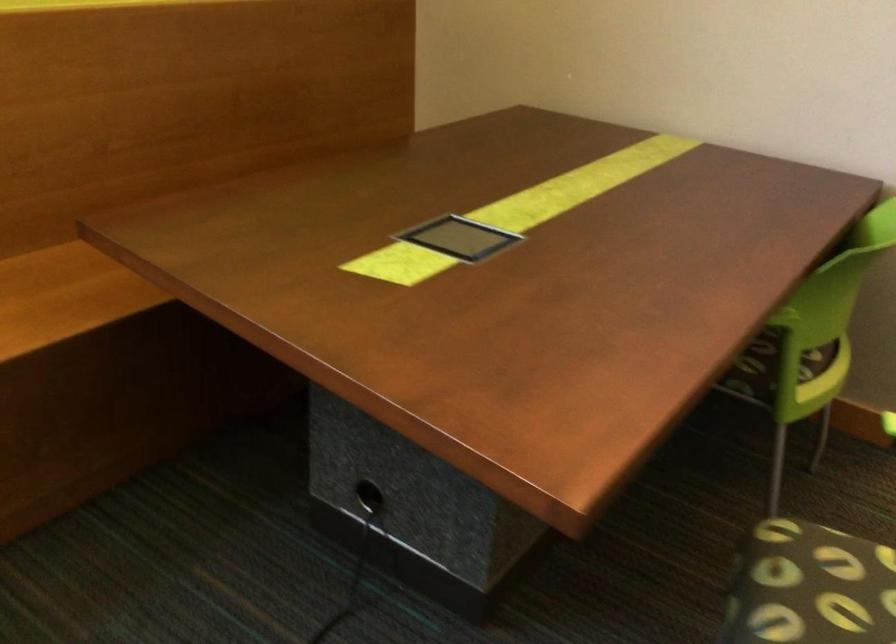
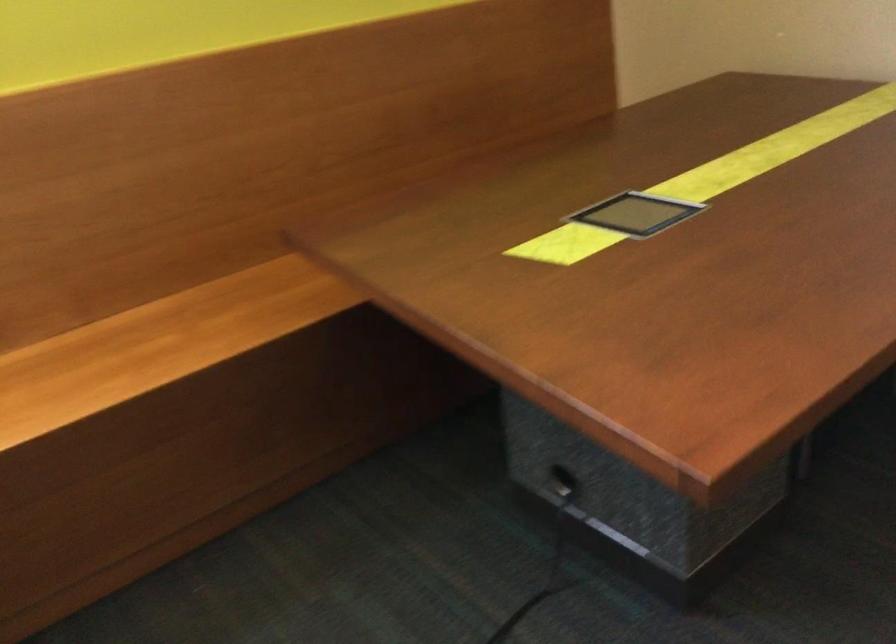
Question: The images are taken continuously from a first-person perspective. In which direction are you moving?

Choices:
 (A) Left
 (B) Right
 (C) Forward
 (D) Backward

Answer: (B)